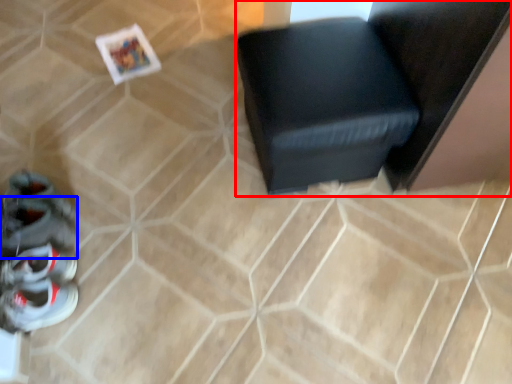
Question: Which point is further to the camera, furniture (highlighted by a red box) or shoe (highlighted by a blue box)?

Choices:
 (A) furniture
 (B) shoe

Answer: (B)